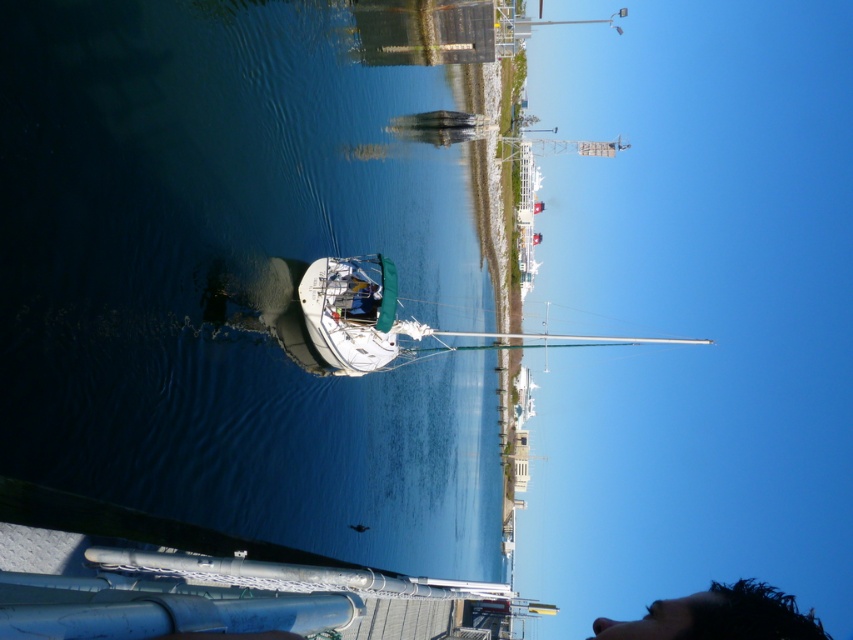
You are standing on the dock and want to take a photo of the white glossy water at center and the white glossy sailboat at center. Which object should you focus on first to ensure it appears sharp in the foreground?

You should focus on the white glossy water at center first because it is closer to the viewer than the white glossy sailboat at center, making it the foreground element.

You are standing on the dock and looking at the white sailboat in the center. There is a point marked at coordinates (235, 280). Where is this point located in relation to the white sailboat?

The point at coordinates (235, 280) is on the white glossy water at center, which is where the white sailboat is moored. Therefore, the point is located on the water surface near the sailboat.

You are a photographer standing at the edge of the dock and want to capture both points in your photo. The first point is labeled as point (x=395, y=348) and the second is point (x=815, y=634). Since you want to focus on the closer one, which point should you adjust your camera to focus on?

Point (x=395, y=348) is further to the viewer than point (x=815, y=634), so you should focus on point (x=395, y=348) as it is closer to you.